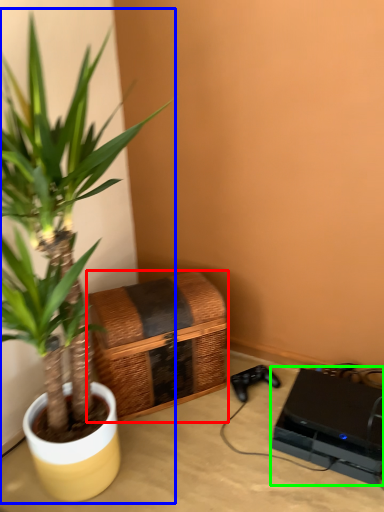
Question: Based on their relative distances, which object is farther from basket (highlighted by a red box)? Choose from houseplant (highlighted by a blue box) and computer (highlighted by a green box).

Choices:
 (A) houseplant
 (B) computer

Answer: (B)